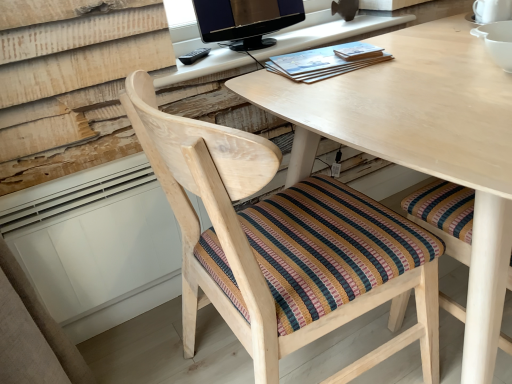
Question: Is blue paperback book at center located outside natural wood chair at center?

Choices:
 (A) yes
 (B) no

Answer: (A)

Question: From the image's perspective, is blue paperback book at center located beneath natural wood chair at center?

Choices:
 (A) yes
 (B) no

Answer: (B)

Question: Does blue paperback book at center have a greater height compared to natural wood chair at center?

Choices:
 (A) no
 (B) yes

Answer: (A)

Question: Is blue paperback book at center oriented towards natural wood chair at center?

Choices:
 (A) no
 (B) yes

Answer: (B)

Question: Is blue paperback book at center positioned with its back to natural wood chair at center?

Choices:
 (A) no
 (B) yes

Answer: (A)

Question: Considering the relative sizes of blue paperback book at center and natural wood chair at center in the image provided, is blue paperback book at center bigger than natural wood chair at center?

Choices:
 (A) yes
 (B) no

Answer: (B)

Question: From the image's perspective, is matte black monitor at upper center under blue paperback book at center?

Choices:
 (A) no
 (B) yes

Answer: (A)

Question: Can you confirm if matte black monitor at upper center is thinner than blue paperback book at center?

Choices:
 (A) yes
 (B) no

Answer: (A)

Question: Is matte black monitor at upper center placed right next to blue paperback book at center?

Choices:
 (A) no
 (B) yes

Answer: (A)

Question: From a real-world perspective, does matte black monitor at upper center sit lower than blue paperback book at center?

Choices:
 (A) no
 (B) yes

Answer: (A)

Question: Is matte black monitor at upper center facing away from blue paperback book at center?

Choices:
 (A) yes
 (B) no

Answer: (B)

Question: Does matte black monitor at upper center have a greater height compared to blue paperback book at center?

Choices:
 (A) no
 (B) yes

Answer: (B)

Question: From the image's perspective, is matte wooden desk at upper center, arranged as the 1th computer desk when viewed from the top, on matte black monitor at upper center?

Choices:
 (A) no
 (B) yes

Answer: (A)